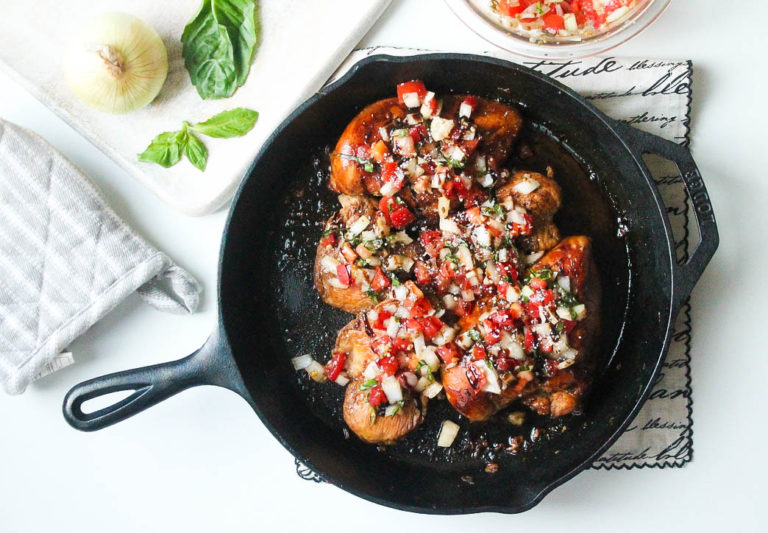
Where is `cutting board`? The image size is (768, 533). cutting board is located at coordinates (290, 30).